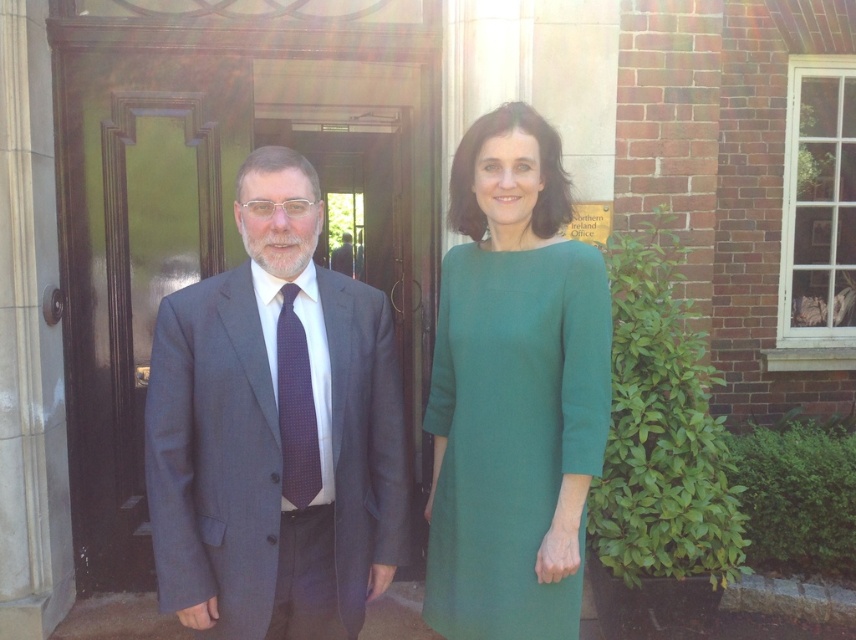
Is matte gray suit at center wider than green woolen dress at center?

Correct, the width of matte gray suit at center exceeds that of green woolen dress at center.

What do you see at coordinates (274, 429) in the screenshot? I see `matte gray suit at center` at bounding box center [274, 429].

Is point (270, 328) positioned before point (440, 634)?

That is True.

Identify the location of matte gray suit at center. The image size is (856, 640). (274, 429).

Can you confirm if matte gray suit at center is shorter than purple dotted tie at center?

No, matte gray suit at center is not shorter than purple dotted tie at center.

In the scene shown: Is matte gray suit at center positioned behind purple dotted tie at center?

No, it is not.

Where is `matte gray suit at center`? The width and height of the screenshot is (856, 640). matte gray suit at center is located at coordinates (274, 429).

Which is below, green woolen dress at center or purple dotted tie at center?

green woolen dress at center is lower down.

Does green woolen dress at center appear on the left side of purple dotted tie at center?

Incorrect, green woolen dress at center is not on the left side of purple dotted tie at center.

Describe the element at coordinates (512, 432) in the screenshot. I see `green woolen dress at center` at that location.

At what (x,y) coordinates should I click in order to perform the action: click on green woolen dress at center. Please return your answer as a coordinate pair (x, y). Looking at the image, I should click on (512, 432).